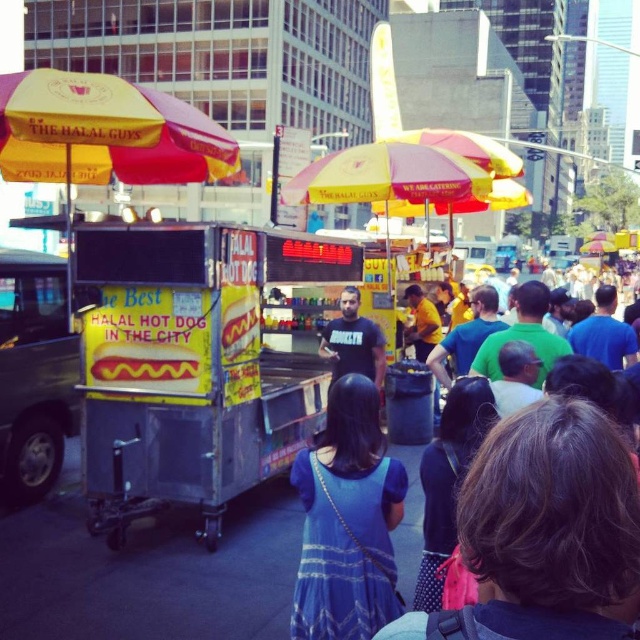
Question: Does rusty metal hot dog cart at center lie in front of black cotton t-shirt at center?

Choices:
 (A) yes
 (B) no

Answer: (A)

Question: Which object is farther from the camera taking this photo?

Choices:
 (A) yellow matte hot dog at center
 (B) rusty metal hot dog cart at center
 (C) black cotton t-shirt at center

Answer: (C)

Question: Does blue fabric dress at lower center appear under black cotton t-shirt at center?

Choices:
 (A) yes
 (B) no

Answer: (A)

Question: Observing the image, what is the correct spatial positioning of yellow matte hot dog at center in reference to black cotton t-shirt at center?

Choices:
 (A) right
 (B) left

Answer: (B)

Question: Which object is the farthest from the rusty metal hot dog cart at center?

Choices:
 (A) blue fabric dress at lower center
 (B) black cotton t-shirt at center

Answer: (A)

Question: Considering the real-world distances, which object is closest to the rusty metal hot dog cart at center?

Choices:
 (A) yellow fabric umbrella at upper left
 (B) yellow matte hot dog at center

Answer: (B)